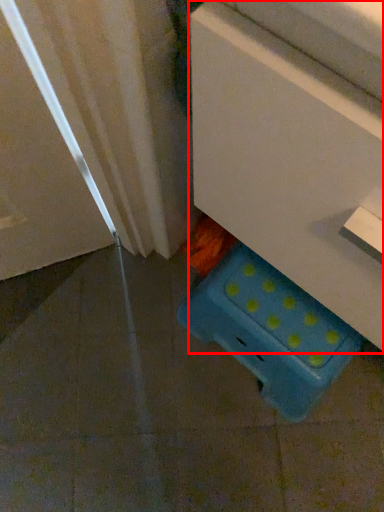
Question: From the image, what is the correct spatial relationship of furniture (annotated by the red box) in relation to storage box?

Choices:
 (A) right
 (B) left

Answer: (A)